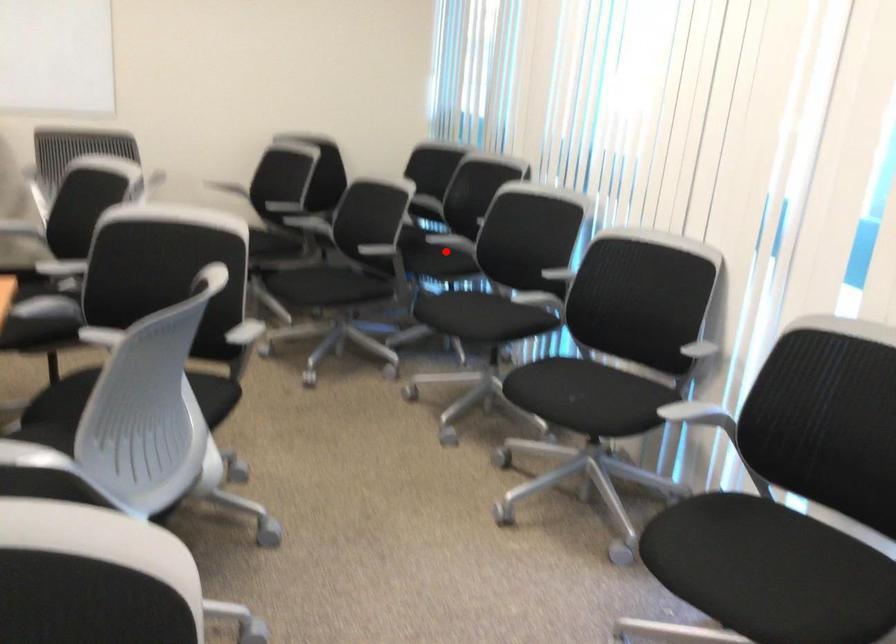
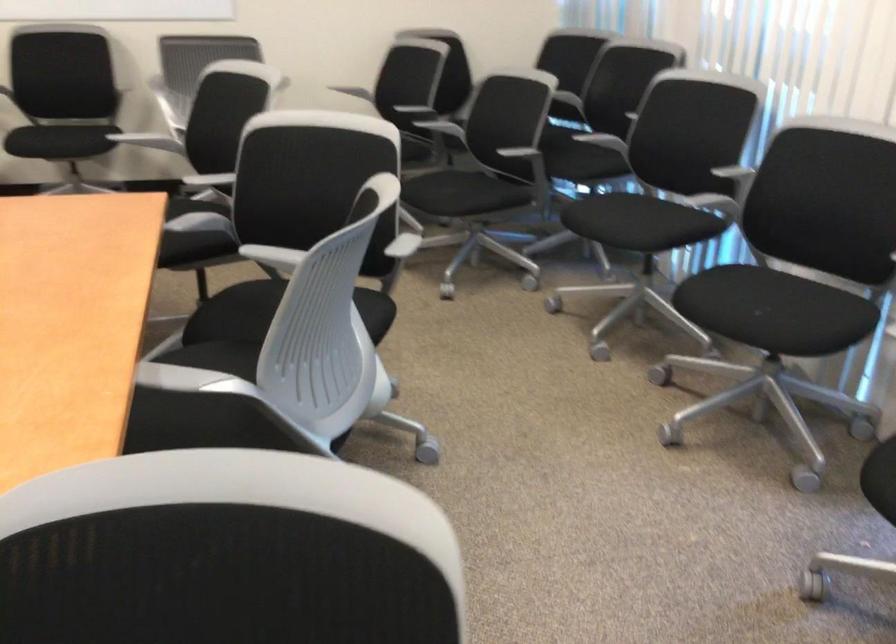
The point at the highlighted location is marked in the first image. Where is the corresponding point in the second image?

(588, 147)